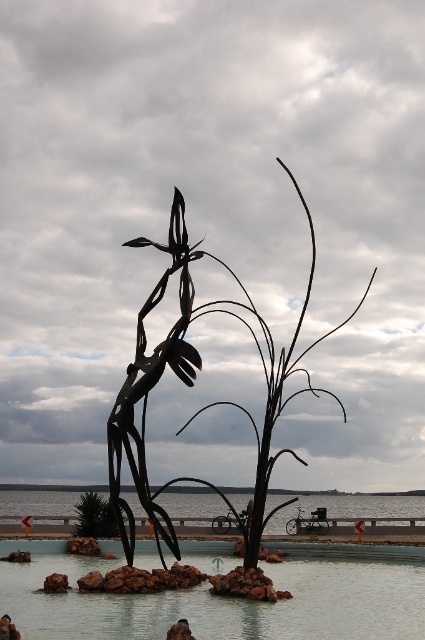
Who is positioned more to the left, smooth concrete pool at center or black metal tree at center?

From the viewer's perspective, black metal tree at center appears more on the left side.

Does smooth concrete pool at center appear over black metal tree at center?

Actually, smooth concrete pool at center is below black metal tree at center.

Find the location of a particular element. This screenshot has width=425, height=640. smooth concrete pool at center is located at coordinates (227, 596).

Based on the photo, measure the distance from black metal tree at center to green leafy tree at center.

black metal tree at center and green leafy tree at center are 9.12 feet apart.

Can you confirm if black metal tree at center is positioned to the right of green leafy tree at center?

Correct, you'll find black metal tree at center to the right of green leafy tree at center.

The height and width of the screenshot is (640, 425). Identify the location of black metal tree at center. (271, 388).

What do you see at coordinates (354, 508) in the screenshot?
I see `clear water at center` at bounding box center [354, 508].

Does clear water at center appear under brown rock at lower left?

Yes.

Does point (394, 513) come in front of point (51, 573)?

No, it is not.

Find the location of a particular element. This screenshot has height=640, width=425. clear water at center is located at coordinates (354, 508).